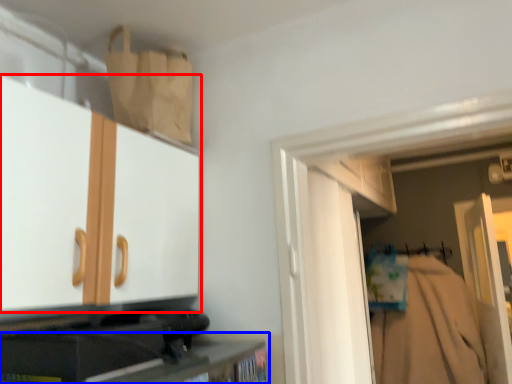
Question: Which object is further to the camera taking this photo, cabinetry (highlighted by a red box) or cabinetry (highlighted by a blue box)?

Choices:
 (A) cabinetry
 (B) cabinetry

Answer: (B)